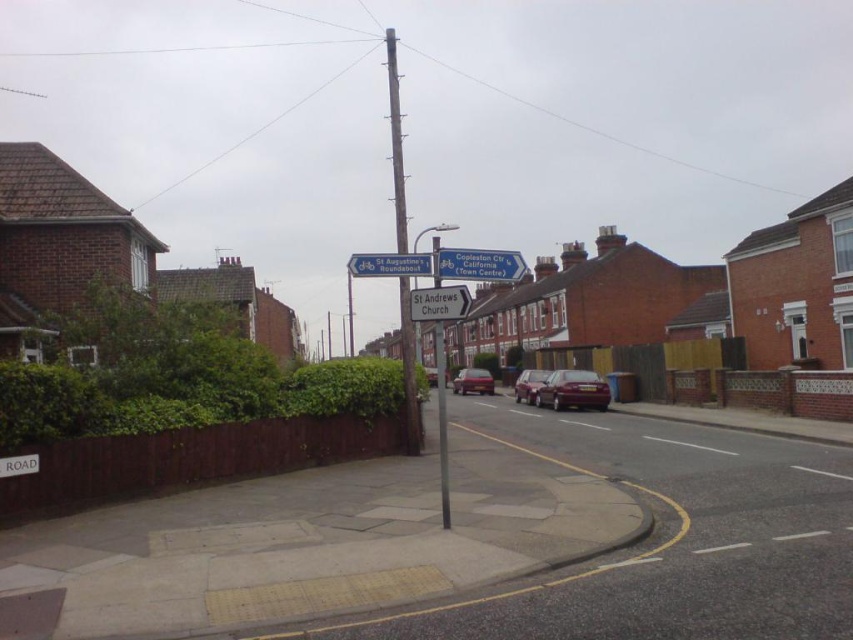
You are a pedestrian trying to read the white plastic street sign at upper center while standing near the metallic silver car at center. Can you see the entire sign clearly without any obstruction?

The white plastic street sign at upper center is in front of the metallic silver car at center, so it is blocking your view of the sign. You cannot see the entire sign clearly.

You are standing at point [529,385] on the residential street. What object is located exactly at your current position?

The shiny metallic car at center is located exactly at point [529,385].

You are a pedestrian standing at the pedestrian crossing and want to cross the street. There are two cars in front of you, a shiny metallic car at center and a metallic silver car at center. Which car is closer to you?

The shiny metallic car at center is closer to you since it is further to the viewer than the metallic silver car at center.